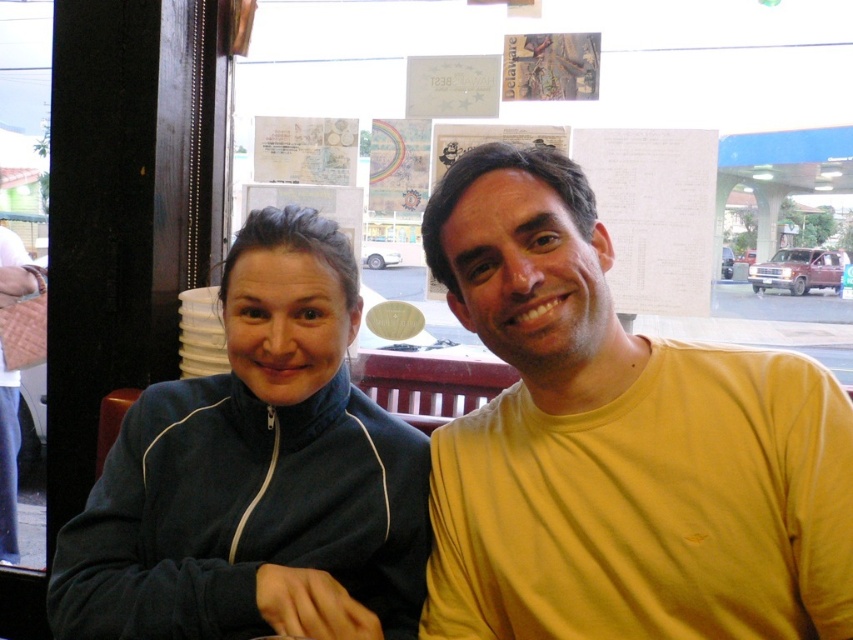
Based on the photo, how distant is yellow cotton t-shirt at center from dark blue zip-up jacket at center?

yellow cotton t-shirt at center is 9.50 inches from dark blue zip-up jacket at center.

Does yellow cotton t-shirt at center have a greater width compared to dark blue zip-up jacket at center?

Incorrect, yellow cotton t-shirt at center's width does not surpass dark blue zip-up jacket at center's.

Who is more distant from viewer, (845, 426) or (297, 390)?

Positioned behind is point (297, 390).

In order to click on yellow cotton t-shirt at center in this screenshot , I will do `click(618, 445)`.